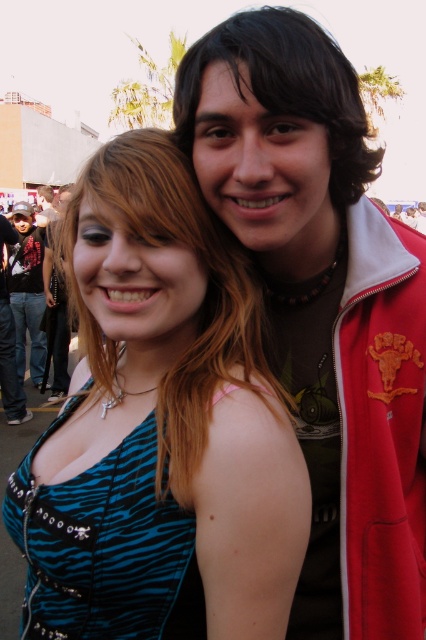
Question: Which point is farther to the camera?

Choices:
 (A) matte brown hair at upper center
 (B) zebra print dress at center
 (C) zebra print fabric dress at center

Answer: (C)

Question: Is the position of blue zebra print dress at center more distant than that of zebra print dress at center?

Choices:
 (A) yes
 (B) no

Answer: (B)

Question: Estimate the real-world distances between objects in this image. Which object is farther from the brushed metal jacket at left?

Choices:
 (A) blue zebra print dress at center
 (B) zebra print fabric dress at center
 (C) zebra print dress at center
 (D) matte brown hair at upper center

Answer: (D)

Question: Does zebra print fabric dress at center come behind matte brown hair at upper center?

Choices:
 (A) yes
 (B) no

Answer: (A)

Question: Among these points, which one is farthest from the camera?

Choices:
 (A) (293, 22)
 (B) (261, 268)
 (C) (149, 252)

Answer: (B)

Question: Does matte brown hair at upper center have a larger size compared to brushed metal jacket at left?

Choices:
 (A) yes
 (B) no

Answer: (B)